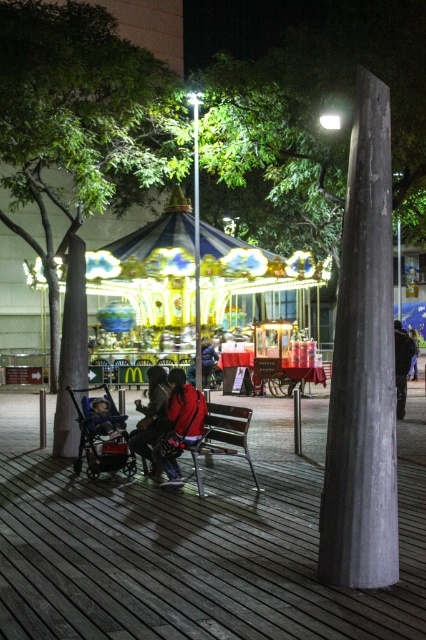
Between point (126, 164) and point (106, 410), which one is positioned behind?

Point (126, 164)

Who is positioned more to the right, green leafy tree at left or dark gray plastic baby carriage at center-left?

dark gray plastic baby carriage at center-left

This screenshot has height=640, width=426. What are the coordinates of `green leafy tree at left` in the screenshot? It's located at (74, 124).

Can you confirm if green leafy tree at left is positioned to the right of blue denim jacket at center?

No, green leafy tree at left is not to the right of blue denim jacket at center.

Does green leafy tree at left have a smaller size compared to blue denim jacket at center?

No, green leafy tree at left is not smaller than blue denim jacket at center.

Does point (114, 77) lie in front of point (209, 380)?

Yes, it is in front of point (209, 380).

Where is `green leafy tree at left`? Image resolution: width=426 pixels, height=640 pixels. green leafy tree at left is located at coordinates (74, 124).

Who is more forward, (195, 454) or (405, 385)?

Point (195, 454) is more forward.

Who is more distant from viewer, (236, 433) or (403, 380)?

Positioned behind is point (403, 380).

This screenshot has height=640, width=426. I want to click on wooden bench at center, so click(222, 436).

Image resolution: width=426 pixels, height=640 pixels. I want to click on wooden bench at center, so click(222, 436).